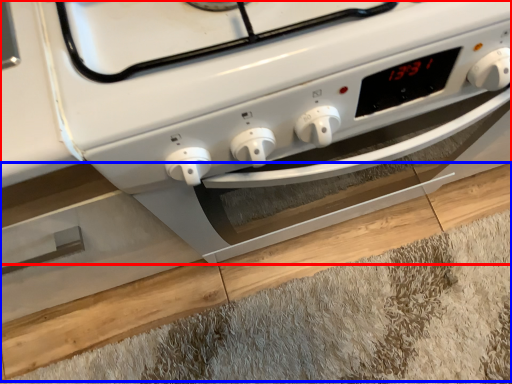
Question: Which object is further to the camera taking this photo, home appliance (highlighted by a red box) or hardwood (highlighted by a blue box)?

Choices:
 (A) home appliance
 (B) hardwood

Answer: (B)